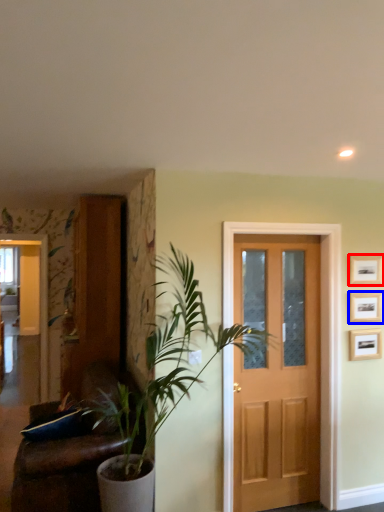
Question: Among these objects, which one is farthest to the camera, picture frame (highlighted by a red box) or picture frame (highlighted by a blue box)?

Choices:
 (A) picture frame
 (B) picture frame

Answer: (B)